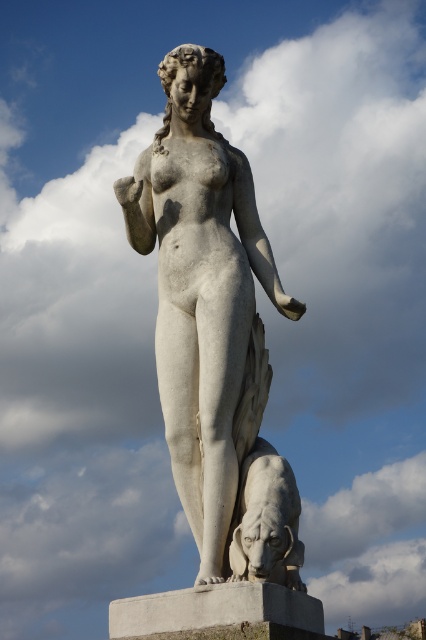
Question: Is white marble statue at center wider than white marble lion at lower center?

Choices:
 (A) yes
 (B) no

Answer: (A)

Question: Does white marble statue at center appear under white marble lion at lower center?

Choices:
 (A) yes
 (B) no

Answer: (B)

Question: Can you confirm if white marble statue at center is wider than white marble lion at lower center?

Choices:
 (A) no
 (B) yes

Answer: (B)

Question: Which object appears farthest from the camera in this image?

Choices:
 (A) white marble statue at center
 (B) white marble lion at lower center

Answer: (A)